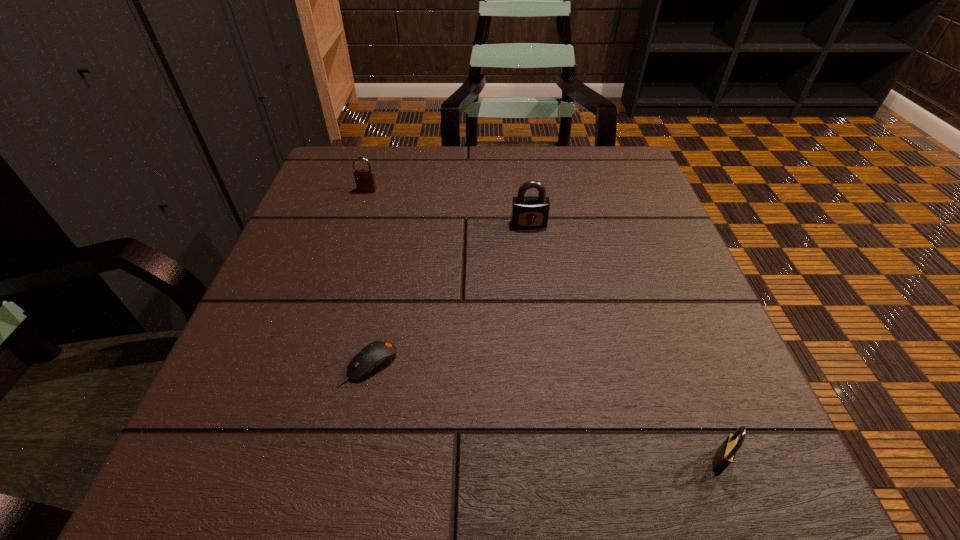
The height and width of the screenshot is (540, 960). Identify the location of free region at the left edge of the desktop. (293, 220).

I want to click on vacant point at the right edge, so click(613, 241).

You are a GUI agent. You are given a task and a screenshot of the screen. Output one action in this format:
    pyautogui.click(x=<x>, y=<y>)
    Task: Click on the blank space at the far left corner
    This screenshot has height=540, width=960.
    Given the screenshot: What is the action you would take?
    pyautogui.click(x=335, y=191)

Identify the location of vacant region at the far right corner of the desktop. Image resolution: width=960 pixels, height=540 pixels. (586, 159).

Where is `free space between the second nearest object and the nearest padlock`? The height and width of the screenshot is (540, 960). free space between the second nearest object and the nearest padlock is located at coordinates (544, 413).

This screenshot has height=540, width=960. I want to click on vacant space that's between the nearest object and the tallest padlock, so click(624, 342).

Image resolution: width=960 pixels, height=540 pixels. What are the coordinates of `vacant area between the leftmost padlock and the computer mouse` in the screenshot? It's located at (369, 278).

Identify the location of blank region between the second farthest padlock and the farthest object. The width and height of the screenshot is (960, 540). (448, 207).

The width and height of the screenshot is (960, 540). I want to click on vacant space that is in between the third nearest object and the leftmost object, so pyautogui.click(x=448, y=207).

At what (x,y) coordinates should I click in order to perform the action: click on vacant point located between the computer mouse and the tallest padlock. Please return your answer as a coordinate pair (x, y). The height and width of the screenshot is (540, 960). Looking at the image, I should click on (449, 294).